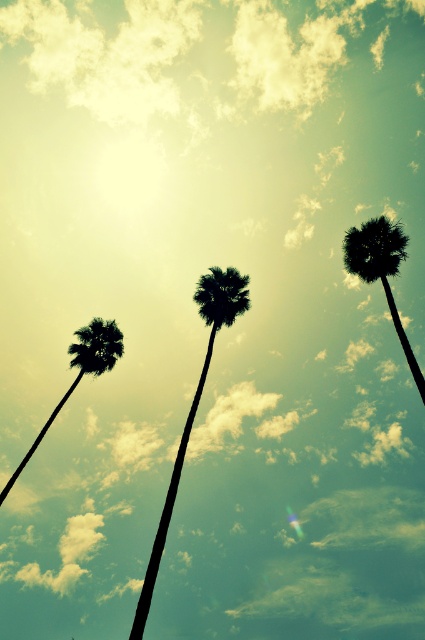
Who is more forward, (190, 422) or (390, 236)?

Positioned in front is point (190, 422).

Does black textured palm tree at center have a smaller size compared to silhouette palm tree at center?

No.

Between point (200, 388) and point (376, 221), which one is positioned behind?

Positioned behind is point (376, 221).

At what (x,y) coordinates should I click in order to perform the action: click on black textured palm tree at center. Please return your answer as a coordinate pair (x, y). Looking at the image, I should click on (192, 406).

The image size is (425, 640). Describe the element at coordinates (192, 406) in the screenshot. I see `black textured palm tree at center` at that location.

Who is taller, black textured palm tree at center or green leafy palm at left?

With more height is black textured palm tree at center.

Between point (156, 548) and point (113, 352), which one is positioned behind?

The point (113, 352) is more distant.

The width and height of the screenshot is (425, 640). What are the coordinates of `black textured palm tree at center` in the screenshot? It's located at (192, 406).

What do you see at coordinates (380, 269) in the screenshot? I see `silhouette palm tree at center` at bounding box center [380, 269].

Is silhouette palm tree at center smaller than green leafy palm at left?

Yes.

At what (x,y) coordinates should I click in order to perform the action: click on silhouette palm tree at center. Please return your answer as a coordinate pair (x, y). The height and width of the screenshot is (640, 425). Looking at the image, I should click on (380, 269).

Locate an element on the screen. silhouette palm tree at center is located at coordinates (380, 269).